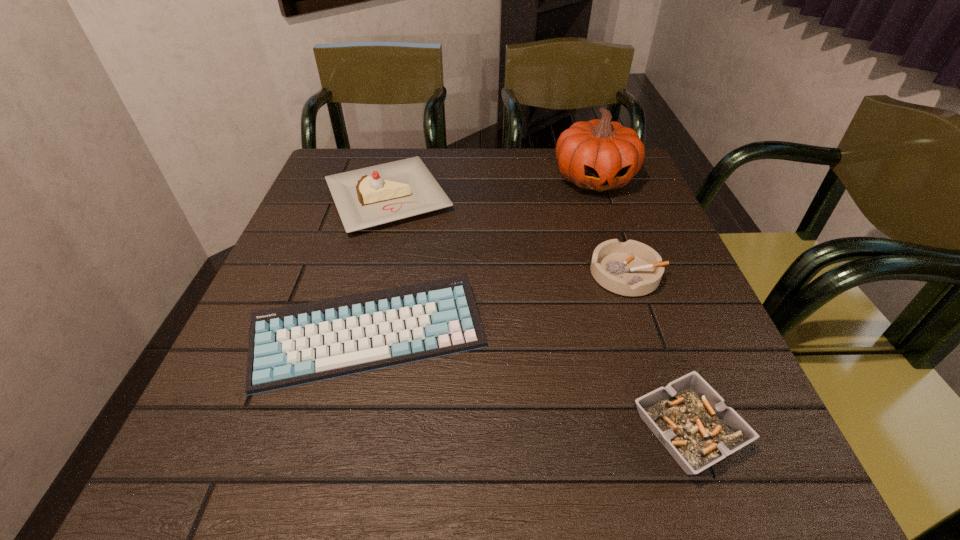
Locate an element on the screen. pumpkin at the far edge is located at coordinates (599, 155).

Identify the location of cake present at the far edge. This screenshot has width=960, height=540. (371, 196).

Find the location of a particular element. The width and height of the screenshot is (960, 540). object located in the near edge section of the desktop is located at coordinates (690, 419).

This screenshot has width=960, height=540. In order to click on cake that is at the left edge in this screenshot , I will do `click(371, 196)`.

Identify the location of computer keyboard at the left edge. (297, 344).

The image size is (960, 540). What are the coordinates of `pumpkin positioned at the right edge` in the screenshot? It's located at (599, 155).

Image resolution: width=960 pixels, height=540 pixels. I want to click on object that is positioned at the far left corner, so click(371, 196).

This screenshot has width=960, height=540. I want to click on object at the far right corner, so click(599, 155).

Identify the location of object that is positioned at the near right corner. (690, 419).

This screenshot has width=960, height=540. What are the coordinates of `free space at the far edge of the desktop` in the screenshot? It's located at (486, 192).